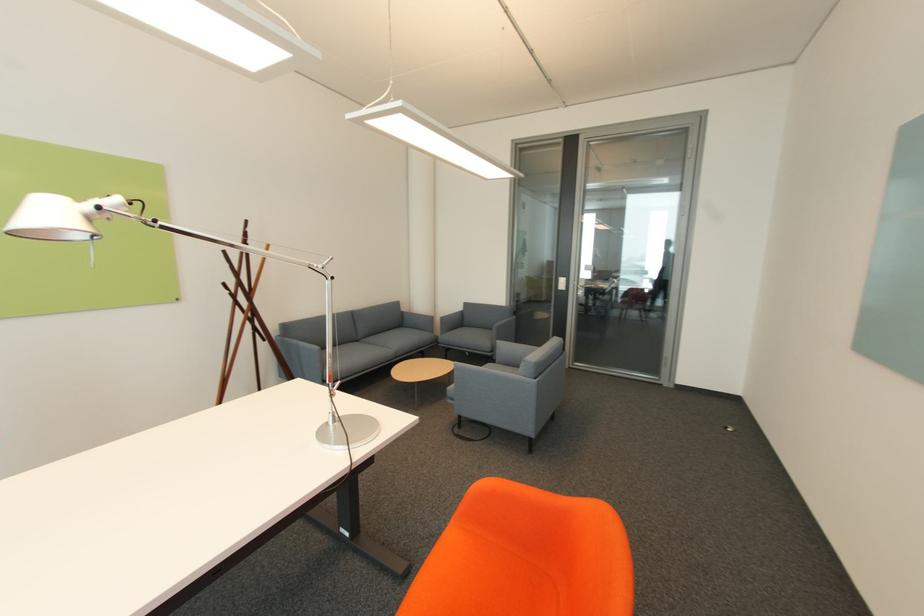
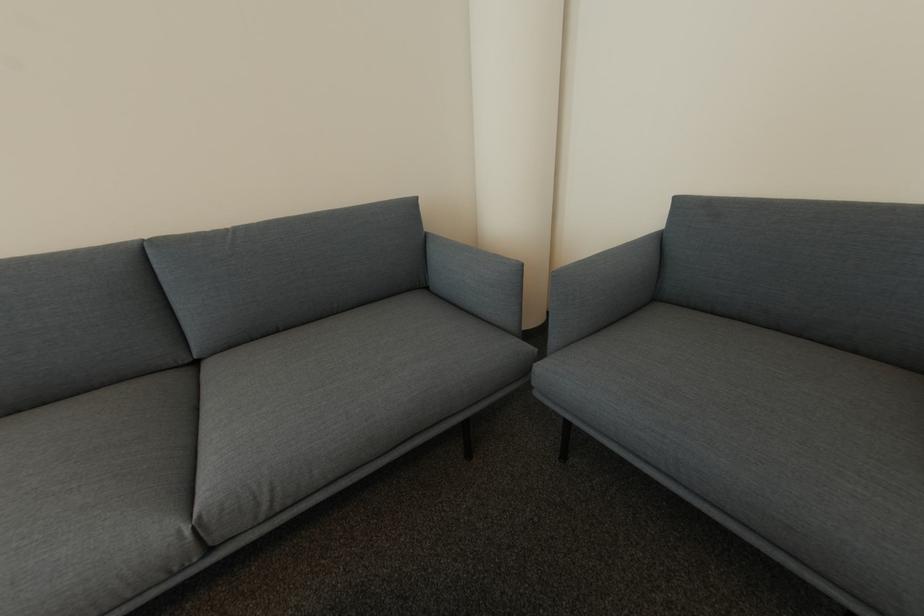
Question: Which direction would the cameraman need to move to produce the second image? Reply with the corresponding letter.

Choices:
 (A) Left
 (B) Right
 (C) Forward
 (D) Backward

Answer: (C)